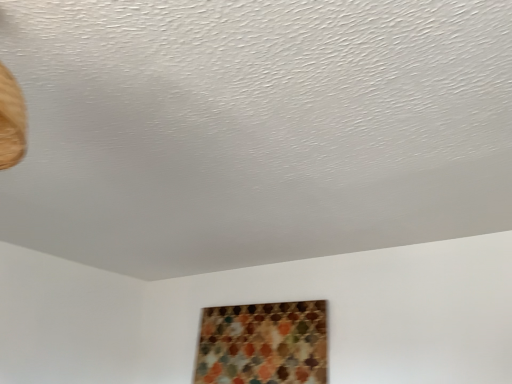
Measure the distance between point [231,339] and camera.

They are 8.09 feet apart.

You are a GUI agent. You are given a task and a screenshot of the screen. Output one action in this format:
    pyautogui.click(x=<x>, y=<y>)
    Task: Click on the multicolored fabric picture frame at lower center
    The image size is (512, 384).
    Given the screenshot: What is the action you would take?
    pyautogui.click(x=263, y=344)

What do you see at coordinates (263, 344) in the screenshot? This screenshot has width=512, height=384. I see `multicolored fabric picture frame at lower center` at bounding box center [263, 344].

This screenshot has width=512, height=384. I want to click on multicolored fabric picture frame at lower center, so click(263, 344).